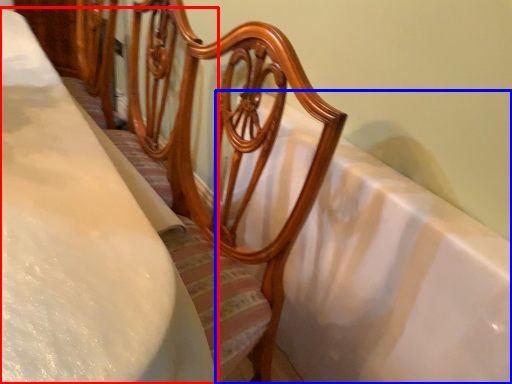
Question: Which of the following is the farthest to the observer, sheet (highlighted by a red box) or bath (highlighted by a blue box)?

Choices:
 (A) sheet
 (B) bath

Answer: (B)